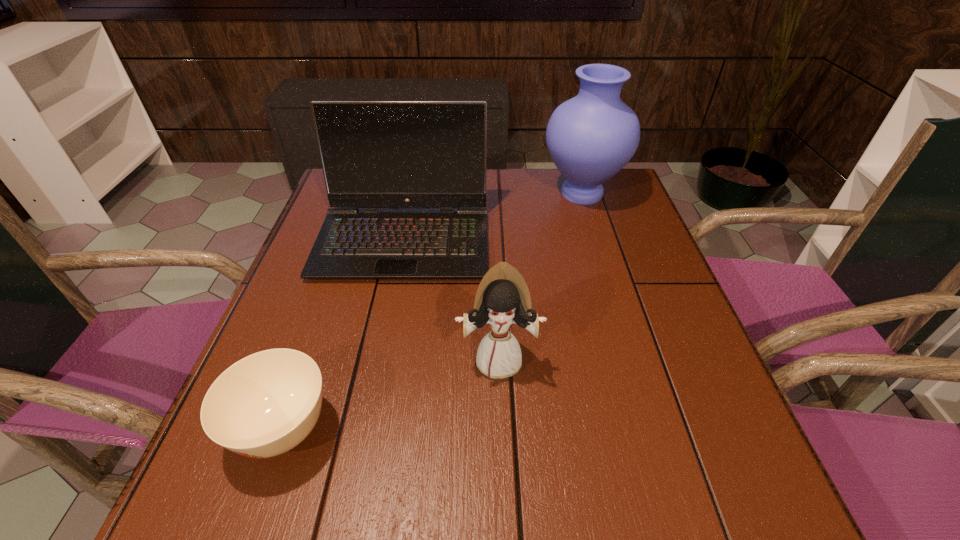
This screenshot has width=960, height=540. Find the location of `vase`. vase is located at coordinates (591, 137).

The image size is (960, 540). I want to click on the third shortest object, so tap(375, 154).

You are a GUI agent. You are given a task and a screenshot of the screen. Output one action in this format:
    pyautogui.click(x=<x>, y=<y>)
    Task: Click on the second shortest object
    The width and height of the screenshot is (960, 540).
    Given the screenshot: What is the action you would take?
    pyautogui.click(x=502, y=299)

The width and height of the screenshot is (960, 540). In order to click on doll in this screenshot , I will do `click(502, 299)`.

The image size is (960, 540). I want to click on sugar bowl, so click(264, 405).

In order to click on the shortest object in this screenshot , I will do `click(264, 405)`.

Identify the location of vacant space located on the left of the rightmost object. (484, 193).

Find the location of a particular element. This screenshot has height=540, width=960. vacant space located 0.260m on the screen of the second tallest object is located at coordinates pyautogui.click(x=374, y=384).

Where is `vacant position located 0.200m at the front face of the doll`? Image resolution: width=960 pixels, height=540 pixels. vacant position located 0.200m at the front face of the doll is located at coordinates (504, 498).

Find the location of `vacant area situated on the back of the sugar bowl`. vacant area situated on the back of the sugar bowl is located at coordinates pos(313,345).